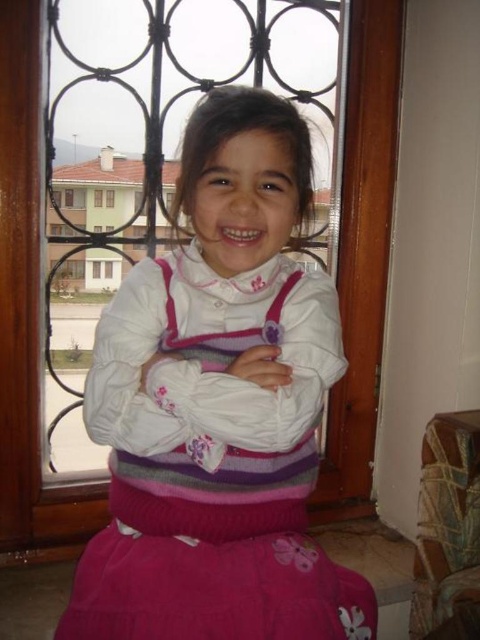
Question: Which point appears closest to the camera in this image?

Choices:
 (A) (309, 138)
 (B) (96, 422)

Answer: (B)

Question: Can you confirm if pink knitted sweater at center is positioned below white matte arm at center?

Choices:
 (A) no
 (B) yes

Answer: (B)

Question: Which point is farther from the camera taking this photo?

Choices:
 (A) (153, 304)
 (B) (108, 326)

Answer: (A)

Question: Does pink knitted sweater at center appear on the right side of white matte arm at center?

Choices:
 (A) no
 (B) yes

Answer: (B)

Question: Is pink knitted sweater at center to the right of white matte arm at center from the viewer's perspective?

Choices:
 (A) yes
 (B) no

Answer: (A)